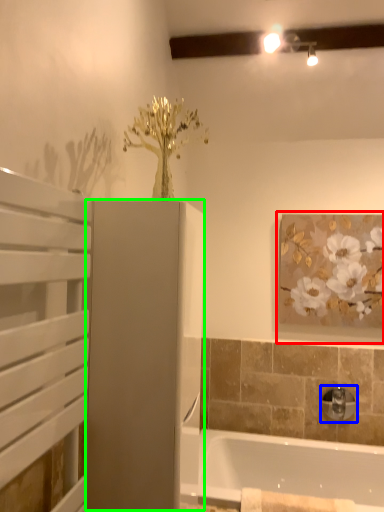
Question: Which object is the farthest from picture frame (highlighted by a red box)? Choose among these: tap (highlighted by a blue box) or screen door (highlighted by a green box).

Choices:
 (A) tap
 (B) screen door

Answer: (B)